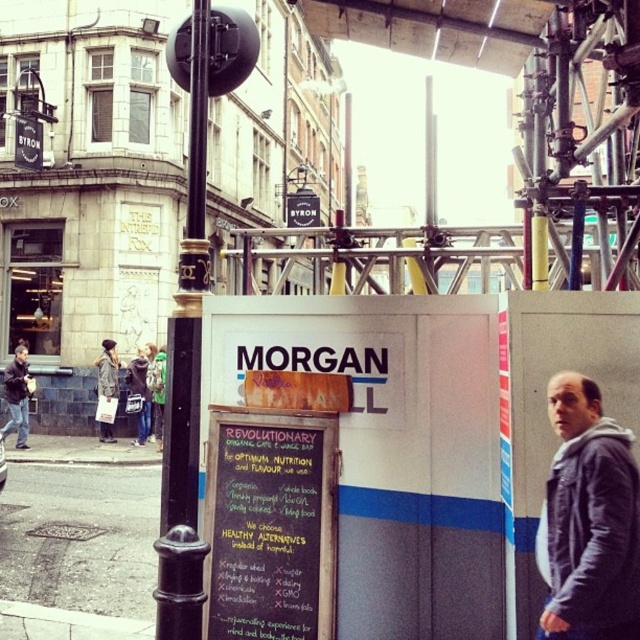
Does point (337, 474) come closer to viewer compared to point (102, 346)?

That is True.

Find the location of a particular element. chalkboard sign at center is located at coordinates (269, 524).

Does chalkboard sign at center appear on the left side of denim jacket at center?

No, chalkboard sign at center is not to the left of denim jacket at center.

Measure the distance between chalkboard sign at center and denim jacket at center.

The distance of chalkboard sign at center from denim jacket at center is 12.78 meters.

Measure the distance between chalkboard sign at center and camera.

A distance of 13.60 feet exists between chalkboard sign at center and camera.

The height and width of the screenshot is (640, 640). Find the location of `chalkboard sign at center`. chalkboard sign at center is located at coordinates (269, 524).

Which is more to the right, chalkboard sign at center or dark gray jacket at left?

chalkboard sign at center

Can you confirm if chalkboard sign at center is thinner than dark gray jacket at left?

No.

Between point (280, 451) and point (4, 429), which one is positioned in front?

Point (280, 451) is more forward.

Where is `chalkboard sign at center`? chalkboard sign at center is located at coordinates (269, 524).